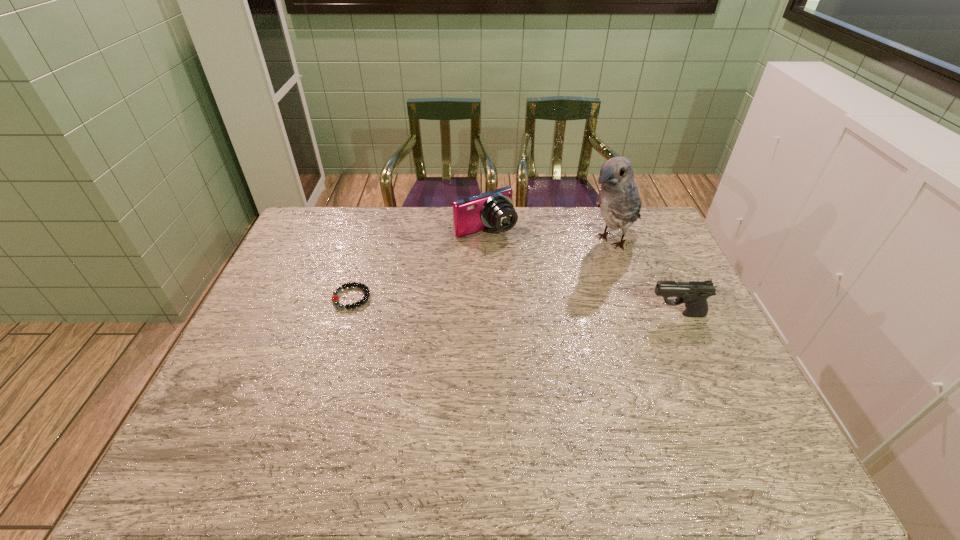
What are the coordinates of `vacant space on the desktop that is between the leftmost object and the pistol and is positioned on the front-facing side of the parrot` in the screenshot? It's located at (521, 307).

The height and width of the screenshot is (540, 960). I want to click on vacant space on the desktop that is between the bracelet and the pistol and is positioned on the front-facing side of the camera, so click(558, 308).